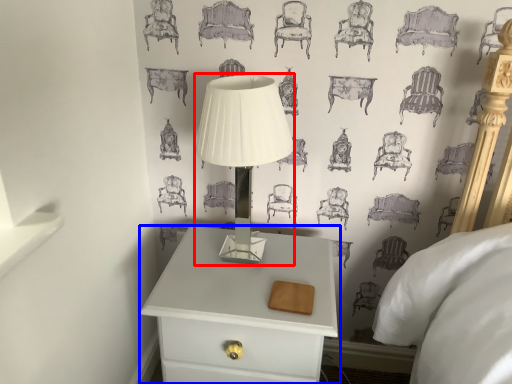
Question: Which of the following is the closest to the observer, table lamp (highlighted by a red box) or nightstand (highlighted by a blue box)?

Choices:
 (A) table lamp
 (B) nightstand

Answer: (A)